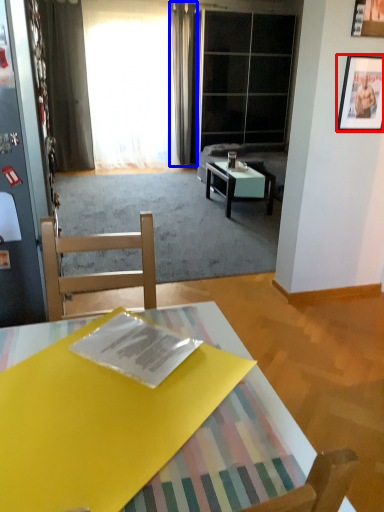
Question: Which object is further to the camera taking this photo, picture frame (highlighted by a red box) or curtain (highlighted by a blue box)?

Choices:
 (A) picture frame
 (B) curtain

Answer: (B)